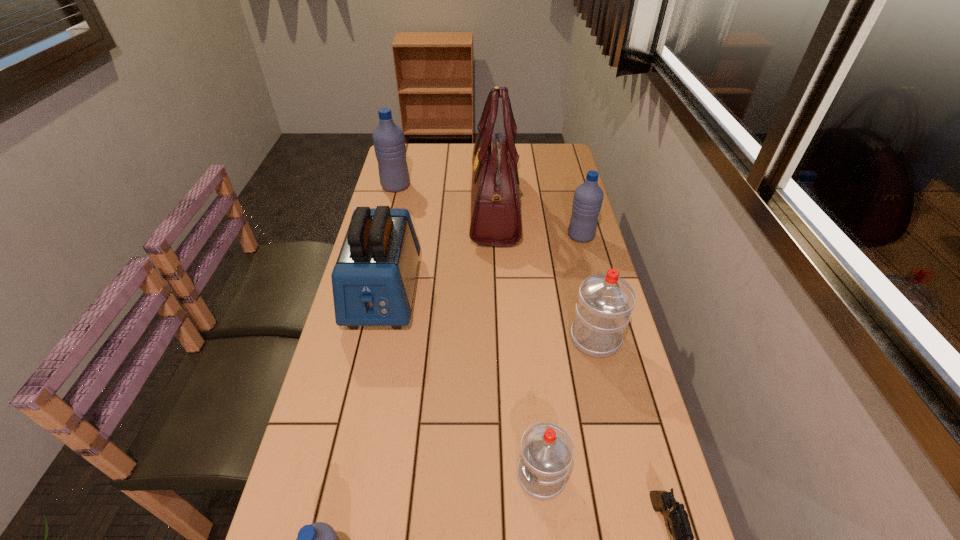
I want to click on the smaller white water bottle, so click(547, 450).

The height and width of the screenshot is (540, 960). Identify the location of vacant space located 0.330m on the front-facing side of the brown handbag. (379, 207).

Find the location of a particular element. free spot located on the front-facing side of the brown handbag is located at coordinates (390, 207).

Find the location of a particular element. blank area located on the front-facing side of the brown handbag is located at coordinates (418, 207).

This screenshot has width=960, height=540. Identify the location of free space located 0.160m on the front of the farthest blue water bottle. tap(387, 220).

I want to click on blank space located on the front-facing side of the blue toaster, so click(361, 395).

The width and height of the screenshot is (960, 540). I want to click on free space located 0.110m on the left of the rightmost blue water bottle, so click(535, 236).

You are a GUI agent. You are given a task and a screenshot of the screen. Output one action in this format:
    pyautogui.click(x=<x>, y=<y>)
    Task: Click on the vacant space located 0.370m on the handle side of the bigger white water bottle
    This screenshot has height=540, width=960.
    Given the screenshot: What is the action you would take?
    pyautogui.click(x=571, y=235)

This screenshot has height=540, width=960. Identify the location of vacant area situated 0.150m on the handle side of the bigger white water bottle. (582, 281).

Where is `vacant space located 0.250m on the handle side of the bigger white water bottle`? The image size is (960, 540). vacant space located 0.250m on the handle side of the bigger white water bottle is located at coordinates (576, 259).